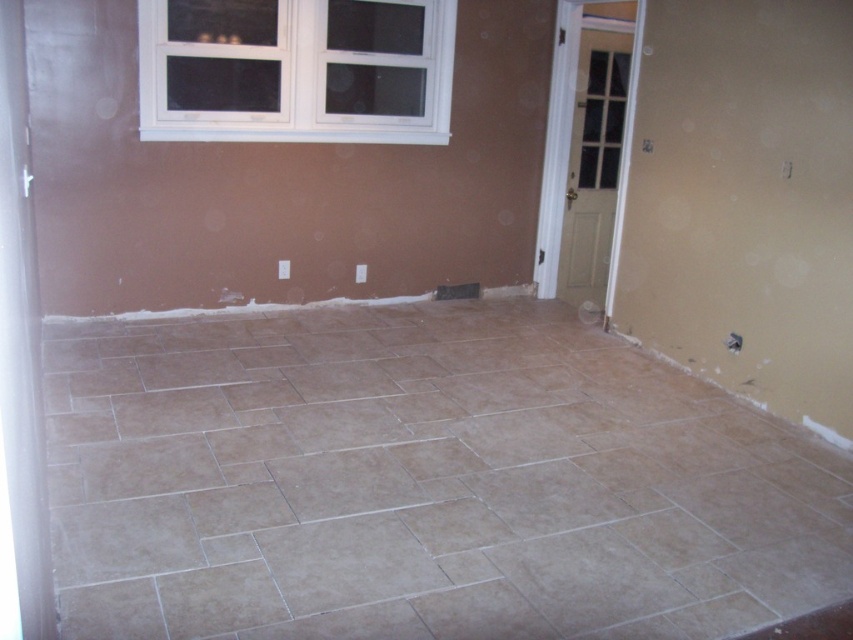
Between beige tile at center and white plastic window at upper center, which one appears on the left side from the viewer's perspective?

From the viewer's perspective, white plastic window at upper center appears more on the left side.

Does beige tile at center have a smaller size compared to white plastic window at upper center?

No, beige tile at center is not smaller than white plastic window at upper center.

Consider the image. Measure the distance between point (x=721, y=499) and camera.

A distance of 3.25 meters exists between point (x=721, y=499) and camera.

Locate an element on the screen. The height and width of the screenshot is (640, 853). beige tile at center is located at coordinates (422, 483).